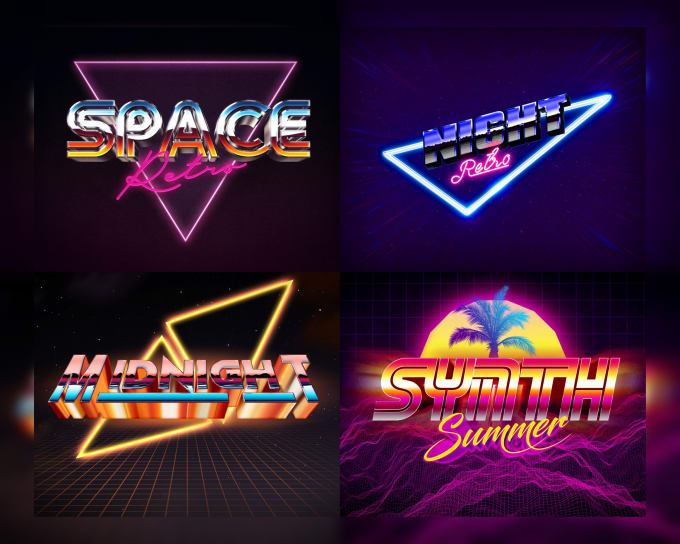
Image resolution: width=680 pixels, height=544 pixels. I want to click on neon light, so click(x=115, y=451).